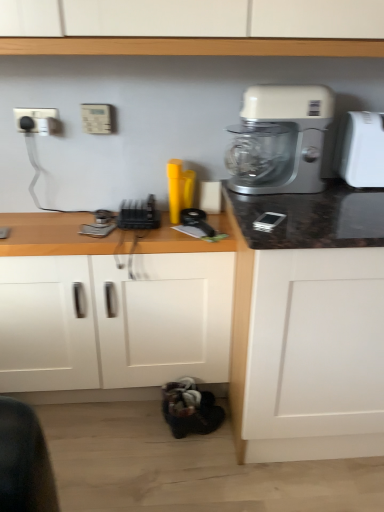
Identify the location of vacant area situated to the left side of black plastic toaster at center. This screenshot has height=512, width=384. (89, 226).